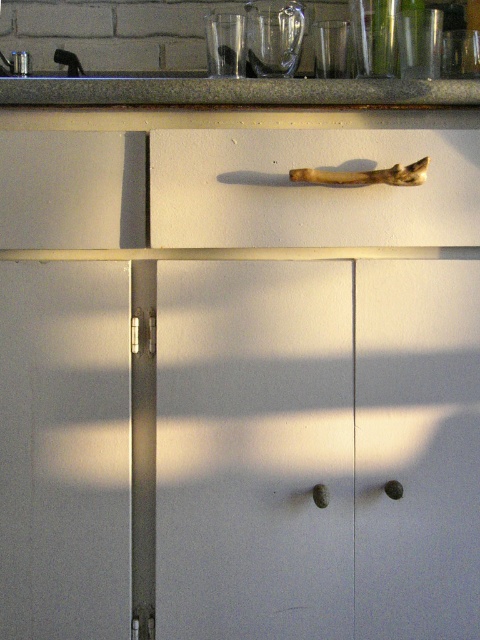
You are a painter standing in front of the kitchen cabinet. You need to paint two points on the cabinet doors. The first point is at point (455, 221) and the second is at point (241, 104). Which point will require you to reach further back to paint?

Point (241, 104) will require reaching further back because it is closer to the cabinet doors, while point (455, 221) is closer to the viewer.

You are a kitchen designer planning to install a new appliance that requires a minimum of 12 centimeters of clearance between the handle and the countertop. Based on the image, will the current spacing between the wooden handle at center and the granite countertop at upper center meet this requirement?

The distance between the wooden handle at center and the granite countertop at upper center is 10.81 centimeters, which is less than the required 12 centimeters. Therefore, the current spacing does not meet the requirement.